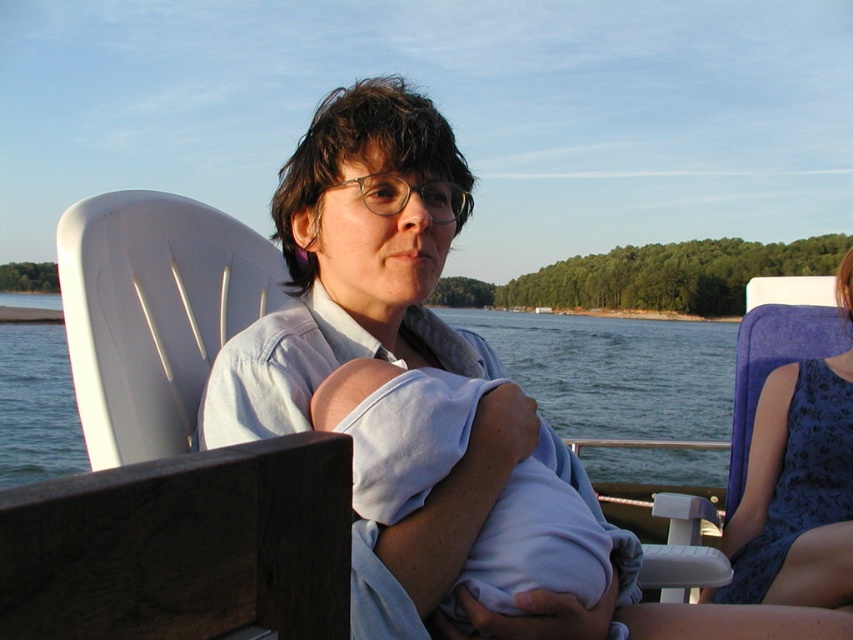
Between matte blue shirt at center and blue lace dress at right, which one appears on the left side from the viewer's perspective?

matte blue shirt at center is more to the left.

Does point (314, 228) come closer to viewer compared to point (846, 387)?

That is True.

The width and height of the screenshot is (853, 640). What are the coordinates of `matte blue shirt at center` in the screenshot? It's located at (352, 260).